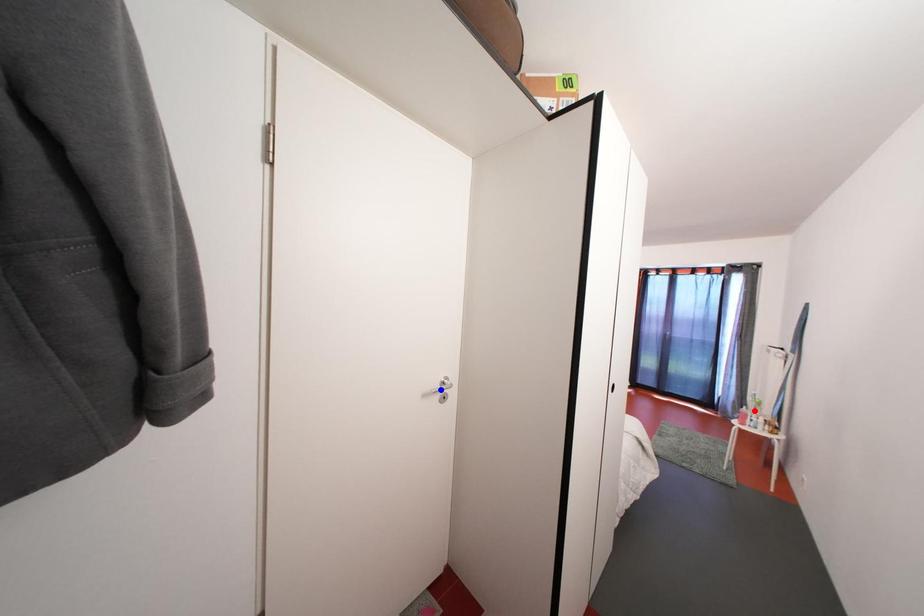
Question: In the image, two points are highlighted. Which point is nearer to the camera? Reply with the corresponding letter.

Choices:
 (A) blue point
 (B) red point

Answer: (A)